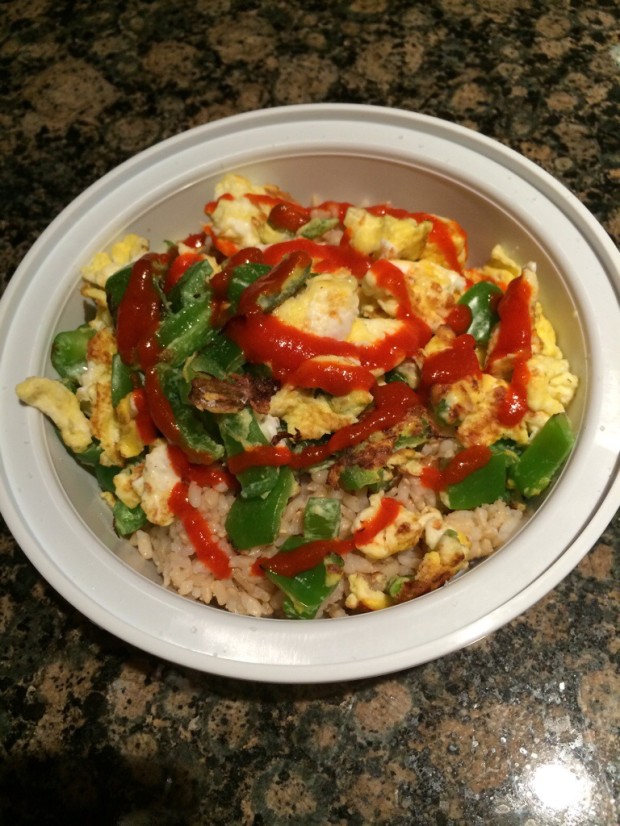
Find the location of a particular element. counter is located at coordinates pos(71,746).